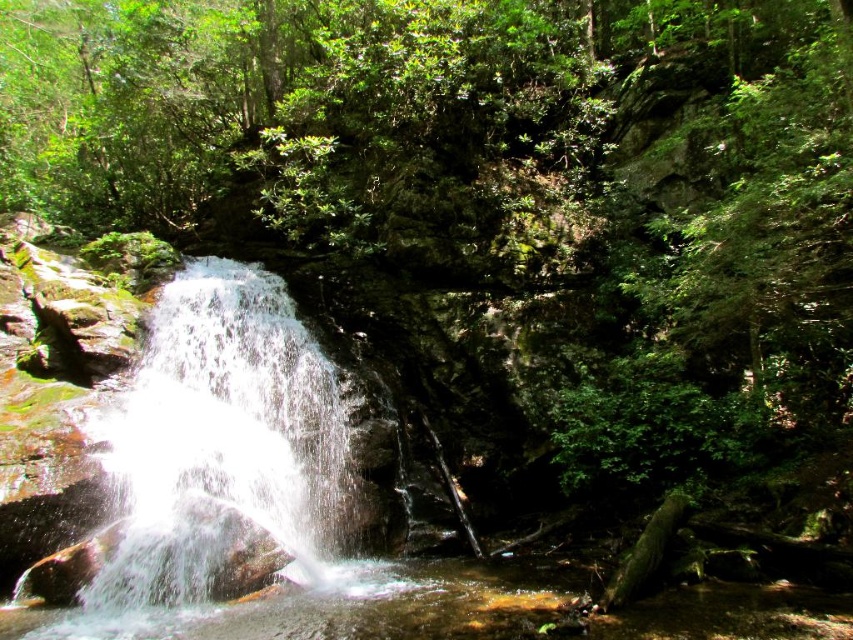
You are a hiker who wants to cross the stream at the center of the scene. You have a 10 feet long wooden plank. Can you place the plank between the white frothy water at center and the clear water at center to cross safely?

The distance between the white frothy water at center and clear water at center is 10.31 feet. Since the plank is only 10 feet long, it is 0.31 feet too short to span the gap safely. You should find a longer plank or another way to cross.

Looking at this image, you are a hiker who wants to cross the waterfall area safely. You see the white frothy water at center and the clear water at center. Which one should you avoid stepping into to prevent slipping?

You should avoid stepping into the white frothy water at center because it is located above the clear water at center and is more turbulent, increasing the risk of slipping.

You are a hiker who wants to cross the calm pool below the waterfall. You have a small rubber boat that can handle up to 1 meter in height difference. Based on the scene, can your boat safely navigate the height difference between the white frothy water at center and the clear water at center?

The white frothy water at center has a greater height compared to clear water at center. Since the boat can handle up to 1 meter, it can safely navigate the height difference between the white frothy water at center and the clear water at center as long as the actual height difference is within that limit.